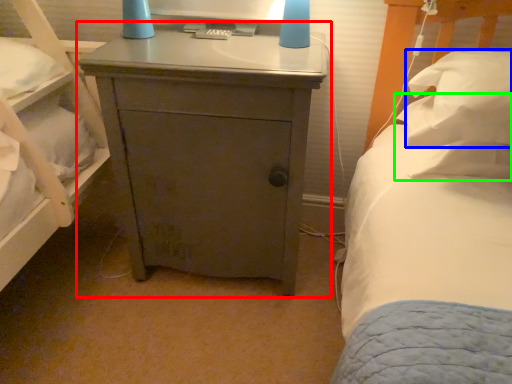
Question: Which is farther away from nightstand (highlighted by a red box)? pillow (highlighted by a blue box) or pillow (highlighted by a green box)?

Choices:
 (A) pillow
 (B) pillow

Answer: (B)